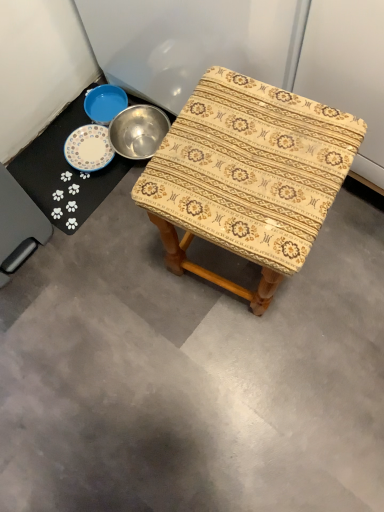
The height and width of the screenshot is (512, 384). I want to click on white glossy plate at upper left, so click(x=65, y=173).

This screenshot has width=384, height=512. What do you see at coordinates (65, 173) in the screenshot?
I see `white glossy plate at upper left` at bounding box center [65, 173].

The image size is (384, 512). I want to click on patterned fabric stool at center, so click(x=248, y=176).

What do you see at coordinates (248, 176) in the screenshot?
I see `patterned fabric stool at center` at bounding box center [248, 176].

Locate an element on the screen. Image resolution: width=384 pixels, height=512 pixels. white glossy plate at upper left is located at coordinates (65, 173).

Considering the relative positions of white glossy plate at upper left and patterned fabric stool at center in the image provided, is white glossy plate at upper left to the left or to the right of patterned fabric stool at center?

white glossy plate at upper left is to the left of patterned fabric stool at center.

Considering the positions of objects white glossy plate at upper left and patterned fabric stool at center in the image provided, who is in front, white glossy plate at upper left or patterned fabric stool at center?

patterned fabric stool at center is closer to the camera.

Considering the positions of points (66, 185) and (209, 224), is point (66, 185) farther from camera compared to point (209, 224)?

Yes, it is behind point (209, 224).

From the image's perspective, is white glossy plate at upper left beneath patterned fabric stool at center?

No, from the image's perspective, white glossy plate at upper left is not beneath patterned fabric stool at center.

From a real-world perspective, is white glossy plate at upper left positioned above or below patterned fabric stool at center?

From a real-world perspective, white glossy plate at upper left is physically below patterned fabric stool at center.

Considering the sizes of white glossy plate at upper left and patterned fabric stool at center in the image, is white glossy plate at upper left wider or thinner than patterned fabric stool at center?

Considering their sizes, white glossy plate at upper left looks slimmer than patterned fabric stool at center.

Between white glossy plate at upper left and patterned fabric stool at center, which one has more height?

With more height is patterned fabric stool at center.

Is white glossy plate at upper left bigger than patterned fabric stool at center?

No.

Is white glossy plate at upper left outside of patterned fabric stool at center?

white glossy plate at upper left lies outside patterned fabric stool at center's area.

Is there a large distance between white glossy plate at upper left and patterned fabric stool at center?

white glossy plate at upper left is actually quite close to patterned fabric stool at center.

Is white glossy plate at upper left oriented towards patterned fabric stool at center?

Yes, white glossy plate at upper left is aimed at patterned fabric stool at center.

Consider the image. What's the angular difference between white glossy plate at upper left and patterned fabric stool at center's facing directions?

The facing directions of white glossy plate at upper left and patterned fabric stool at center are 81.8 degrees apart.

Where is `stool that is below the white glossy plate at upper left (from the image's perspective)`? The width and height of the screenshot is (384, 512). stool that is below the white glossy plate at upper left (from the image's perspective) is located at coordinates (248, 176).

Considering the relative positions of patterned fabric stool at center and white glossy plate at upper left in the image provided, is patterned fabric stool at center to the right of white glossy plate at upper left from the viewer's perspective?

Yes.

Which object is closer to the camera, patterned fabric stool at center or white glossy plate at upper left?

patterned fabric stool at center.

Which is nearer, (207, 99) or (86, 204)?

Point (207, 99).

From the image's perspective, is patterned fabric stool at center positioned above or below white glossy plate at upper left?

From the image's perspective, patterned fabric stool at center appears below white glossy plate at upper left.

From a real-world perspective, is patterned fabric stool at center physically located above or below white glossy plate at upper left?

From a real-world perspective, patterned fabric stool at center is physically above white glossy plate at upper left.

Considering the sizes of patterned fabric stool at center and white glossy plate at upper left in the image, is patterned fabric stool at center wider or thinner than white glossy plate at upper left?

Clearly, patterned fabric stool at center has more width compared to white glossy plate at upper left.

Who is shorter, patterned fabric stool at center or white glossy plate at upper left?

With less height is white glossy plate at upper left.

Is patterned fabric stool at center smaller than white glossy plate at upper left?

Incorrect, patterned fabric stool at center is not smaller in size than white glossy plate at upper left.

Is patterned fabric stool at center outside of white glossy plate at upper left?

patterned fabric stool at center is positioned outside white glossy plate at upper left.

Is patterned fabric stool at center not close to white glossy plate at upper left?

patterned fabric stool at center is near white glossy plate at upper left, not far away.

Is white glossy plate at upper left at the back of patterned fabric stool at center?

No, patterned fabric stool at center is not facing away from white glossy plate at upper left.

How many degrees apart are the facing directions of patterned fabric stool at center and white glossy plate at upper left?

81.8 degrees.

You are a GUI agent. You are given a task and a screenshot of the screen. Output one action in this format:
    pyautogui.click(x=<x>, y=<y>)
    Task: Click on the round table that is on the left side of patterned fabric stool at center
    The height and width of the screenshot is (512, 384).
    Given the screenshot: What is the action you would take?
    pyautogui.click(x=65, y=173)

The width and height of the screenshot is (384, 512). Identify the location of round table lying on the left of patterned fabric stool at center. (65, 173).

Identify the location of round table below the patterned fabric stool at center (from a real-world perspective). This screenshot has width=384, height=512. (65, 173).